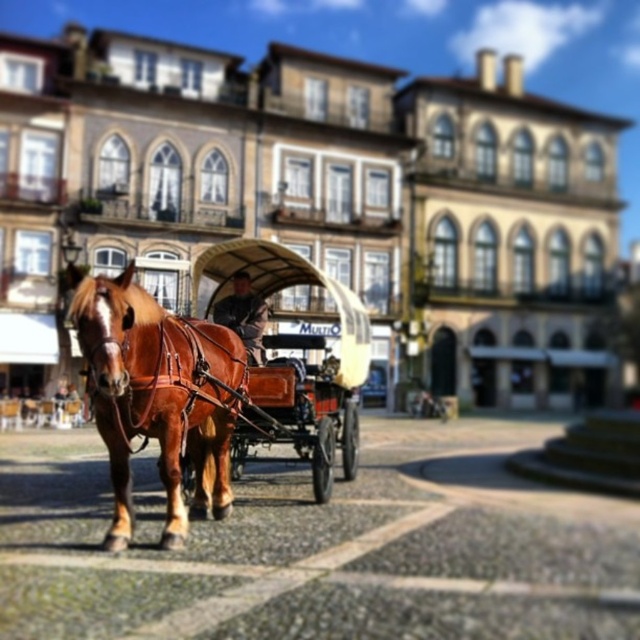
Question: Does shiny brown horse at center have a smaller size compared to shiny brown leather horse cart at center?

Choices:
 (A) no
 (B) yes

Answer: (B)

Question: Observing the image, what is the correct spatial positioning of shiny brown horse at center in reference to wooden polished coach at center?

Choices:
 (A) above
 (B) below

Answer: (B)

Question: From the image, what is the correct spatial relationship of shiny brown leather horse cart at center in relation to wooden polished coach at center?

Choices:
 (A) left
 (B) right

Answer: (A)

Question: Estimate the real-world distances between objects in this image. Which object is farther from the wooden polished coach at center?

Choices:
 (A) shiny brown leather horse cart at center
 (B) shiny brown horse at center

Answer: (B)

Question: Among these objects, which one is nearest to the camera?

Choices:
 (A) wooden polished coach at center
 (B) shiny brown horse at center
 (C) shiny brown leather horse cart at center

Answer: (B)

Question: Among these points, which one is nearest to the camera?

Choices:
 (A) (266, 243)
 (B) (237, 305)
 (C) (170, 532)

Answer: (C)